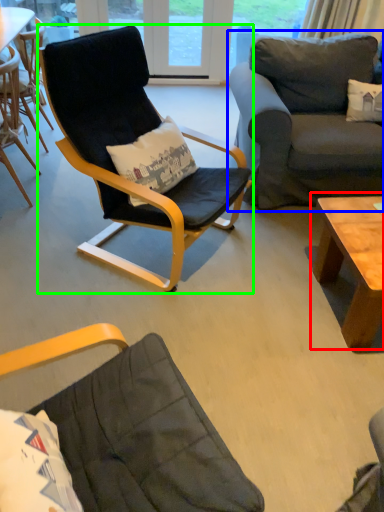
Question: Estimate the real-world distances between objects in this image. Which object is closer to coffee table (highlighted by a red box), studio couch (highlighted by a blue box) or chair (highlighted by a green box)?

Choices:
 (A) studio couch
 (B) chair

Answer: (A)